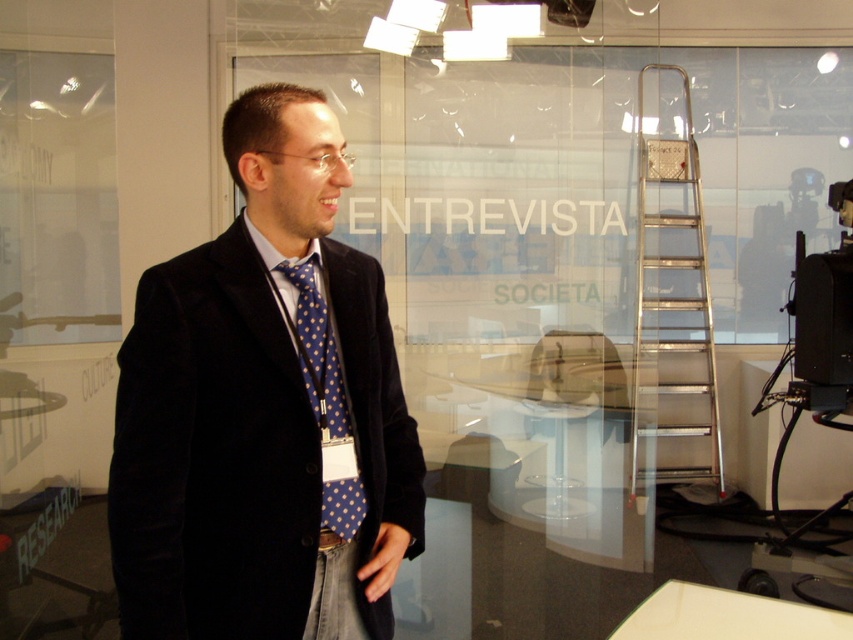
Which of these two, silver metallic ladder at right or black plastic video camera at right, stands shorter?

black plastic video camera at right is shorter.

Is silver metallic ladder at right above black plastic video camera at right?

Indeed, silver metallic ladder at right is positioned over black plastic video camera at right.

Is point (677, 188) positioned in front of point (849, 188)?

No, (677, 188) is behind (849, 188).

Where is `silver metallic ladder at right`? The width and height of the screenshot is (853, 640). silver metallic ladder at right is located at coordinates (672, 296).

Looking at this image, is silver metallic ladder at right shorter than blue dotted fabric tie at center?

No, silver metallic ladder at right is not shorter than blue dotted fabric tie at center.

Can you confirm if silver metallic ladder at right is wider than blue dotted fabric tie at center?

Yes, silver metallic ladder at right is wider than blue dotted fabric tie at center.

Which is behind, point (648, 244) or point (338, 509)?

The point (648, 244) is behind.

At what (x,y) coordinates should I click in order to perform the action: click on silver metallic ladder at right. Please return your answer as a coordinate pair (x, y). Looking at the image, I should click on (672, 296).

Is point (265, 232) positioned in front of point (840, 300)?

Yes.

Can you confirm if velvet black suit at center is bigger than black plastic video camera at right?

Yes.

Does point (189, 280) come closer to viewer compared to point (816, 272)?

Yes, it is.

The height and width of the screenshot is (640, 853). Identify the location of velvet black suit at center. (262, 410).